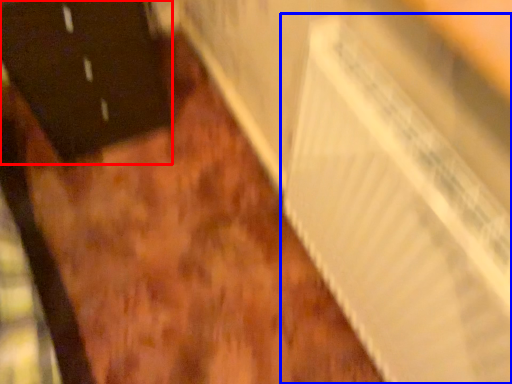
Question: Which of the following is the closest to the observer, door (highlighted by a red box) or radiator (highlighted by a blue box)?

Choices:
 (A) door
 (B) radiator

Answer: (B)